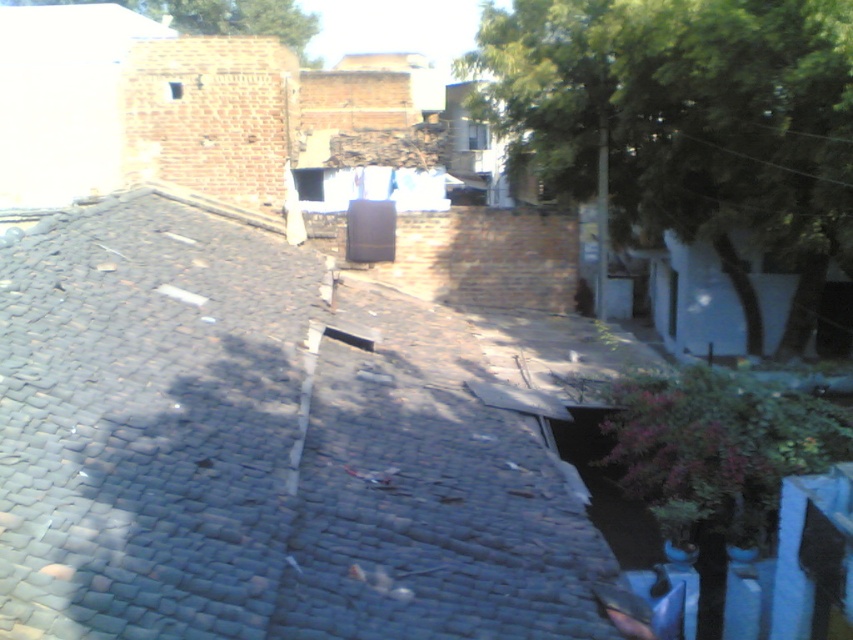
Question: Among these points, which one is farthest from the camera?

Choices:
 (A) (3, 588)
 (B) (799, 70)

Answer: (B)

Question: Which point appears closest to the camera in this image?

Choices:
 (A) (253, 19)
 (B) (608, 100)
 (C) (128, 241)

Answer: (C)

Question: Is dark gray shingles at center to the left of green leafy tree at upper right from the viewer's perspective?

Choices:
 (A) yes
 (B) no

Answer: (A)

Question: Is green leafy tree at upper right smaller than green leafy tree at upper center?

Choices:
 (A) no
 (B) yes

Answer: (A)

Question: Which of the following is the farthest from the observer?

Choices:
 (A) (245, 26)
 (B) (135, 212)

Answer: (A)

Question: Is green leafy tree at upper right positioned before green leafy tree at upper center?

Choices:
 (A) no
 (B) yes

Answer: (B)